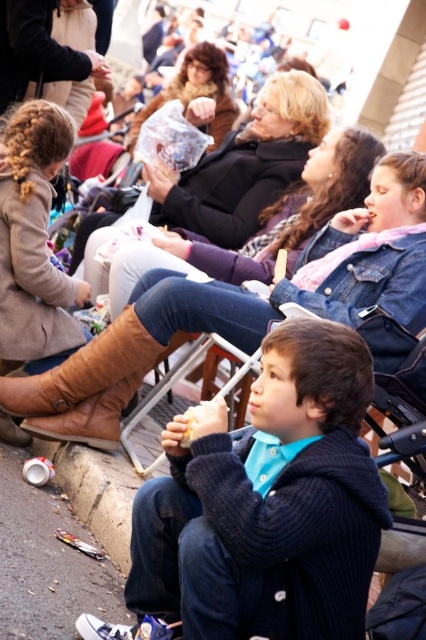
Looking at this image, you are a photographer trying to capture a candid shot of the denim jacket at upper center and the matte brown hair at center. Which object should you focus on first if you want to ensure both are in the frame without moving the camera?

The denim jacket at upper center should be focused on first because it is shorter than the matte brown hair at center, allowing the photographer to adjust the framing to include both objects.

You are a photographer trying to capture the entire scene in one shot. You notice the denim jacket at upper center and the matte brown hair at center. Which object should you focus on to ensure both are in frame without cropping?

The denim jacket at upper center occupies less space than the matte brown hair at center, so focusing on the matte brown hair at center will ensure both are in frame without cropping.